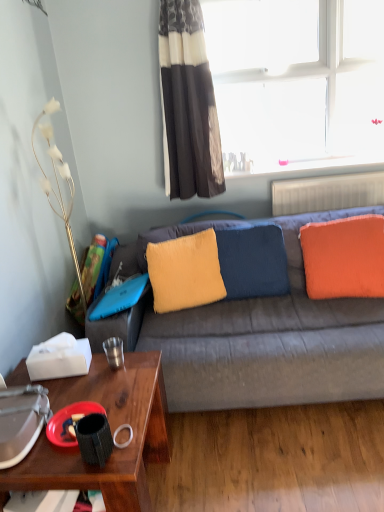
Locate an element on the screen. The image size is (384, 512). free space to the left of metallic silver cup at lower left, marked as the 2th coffee cup in a front-to-back arrangement is located at coordinates (89, 369).